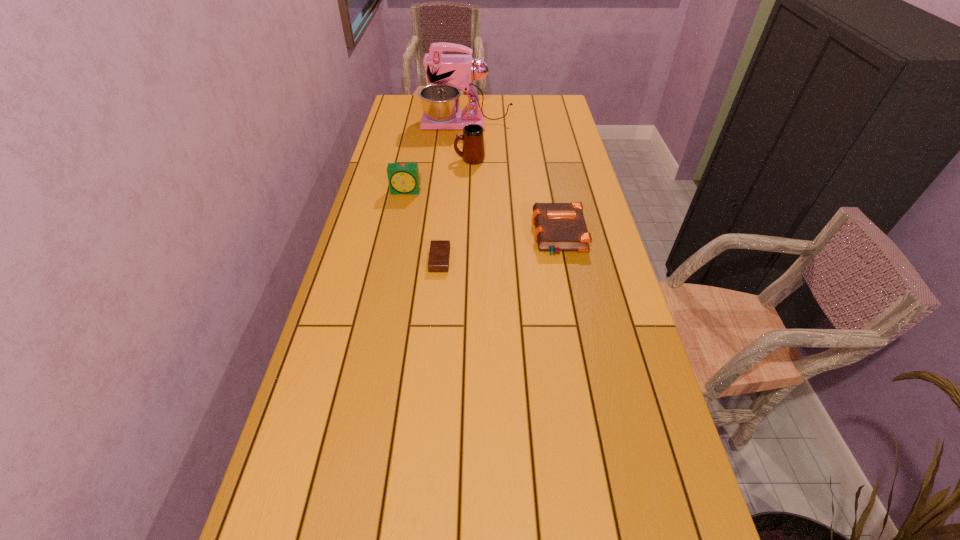
I want to click on mixer that is at the left edge, so click(440, 102).

I want to click on alarm clock located at the left edge, so click(x=403, y=178).

This screenshot has height=540, width=960. I want to click on object at the right edge, so click(x=559, y=227).

The image size is (960, 540). I want to click on object present at the far left corner, so click(440, 102).

Where is `blank space at the far edge`? blank space at the far edge is located at coordinates (484, 109).

At what (x,y) coordinates should I click in order to perform the action: click on free spot at the left edge of the desktop. Please return your answer as a coordinate pair (x, y). This screenshot has height=540, width=960. Looking at the image, I should click on (378, 351).

You are a GUI agent. You are given a task and a screenshot of the screen. Output one action in this format:
    pyautogui.click(x=<x>, y=<y>)
    Task: Click on the blank space at the right edge of the desktop
    Image resolution: width=960 pixels, height=540 pixels.
    Given the screenshot: What is the action you would take?
    pyautogui.click(x=564, y=200)

In the image, there is a desktop. Identify the location of vacant area at the far right corner. (557, 96).

Locate an element on the screen. Image resolution: width=960 pixels, height=540 pixels. empty space that is in between the left alarm clock and the mixer is located at coordinates (437, 158).

At what (x,y) coordinates should I click in order to perform the action: click on free space between the Bible and the second tallest object. Please return your answer as a coordinate pair (x, y). Looking at the image, I should click on (515, 198).